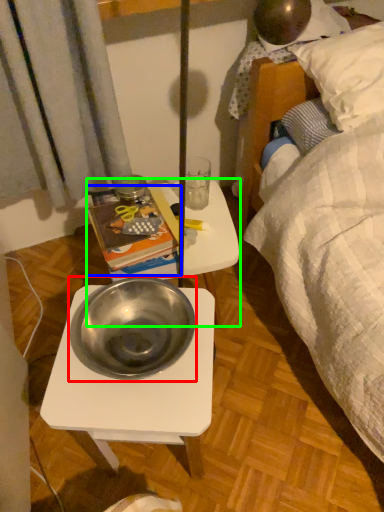
Question: Based on their relative distances, which object is farther from bowl (highlighted by a red box)? Choose from paperback book (highlighted by a blue box) and table (highlighted by a green box).

Choices:
 (A) paperback book
 (B) table

Answer: (B)